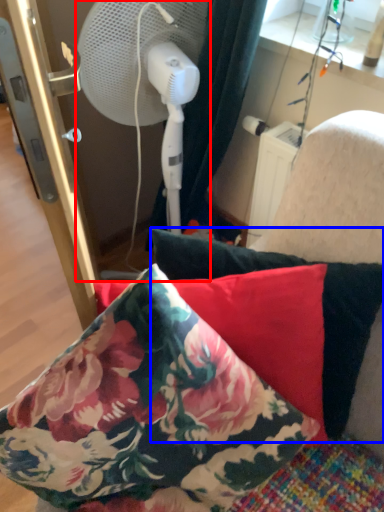
Question: Which object appears closest to the camera in this image, mechanical fan (highlighted by a red box) or pillow (highlighted by a blue box)?

Choices:
 (A) mechanical fan
 (B) pillow

Answer: (B)